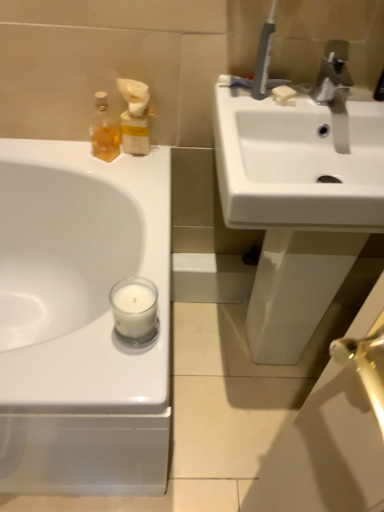
At what (x,y) coordinates should I click in order to perform the action: click on vacant space to the right of translucent glass bottle at upper left. Please return your answer as a coordinate pair (x, y). Image resolution: width=384 pixels, height=512 pixels. Looking at the image, I should click on (149, 166).